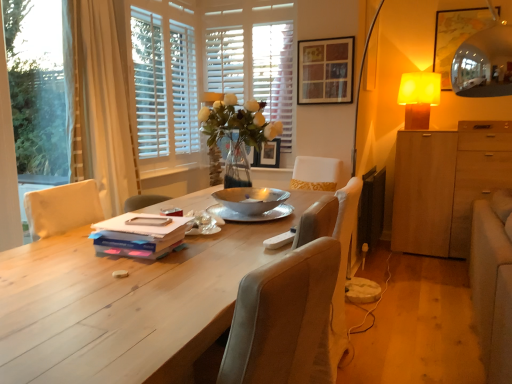
Identify the location of blank space above matte blue book at center (from a real-world perspective). The image size is (512, 384). (136, 225).